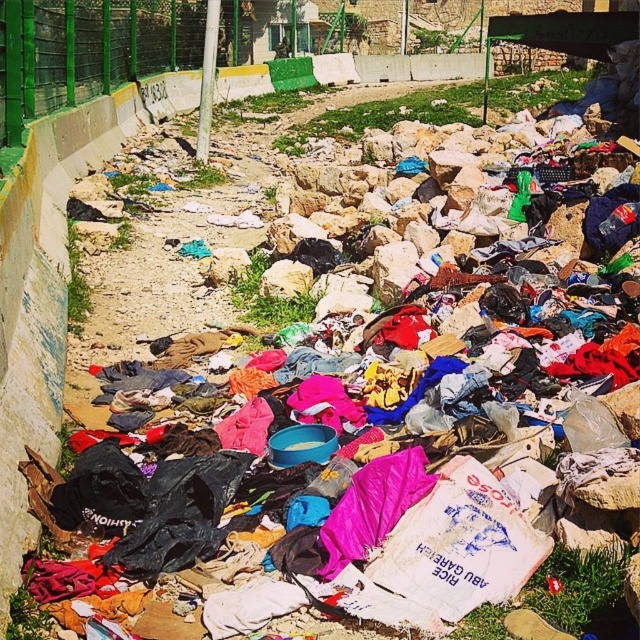
Question: Is green metal fence at upper center above green grass at upper center?

Choices:
 (A) no
 (B) yes

Answer: (A)

Question: Does green metal fence at upper center appear over green grass at upper center?

Choices:
 (A) yes
 (B) no

Answer: (B)

Question: Which of the following is the farthest from the observer?

Choices:
 (A) (362, 125)
 (B) (220, 56)

Answer: (B)

Question: Does green metal fence at upper center have a lesser width compared to green grass at upper center?

Choices:
 (A) yes
 (B) no

Answer: (A)

Question: Which point appears closest to the camera in this image?

Choices:
 (A) pos(449,102)
 (B) pos(65,1)

Answer: (B)